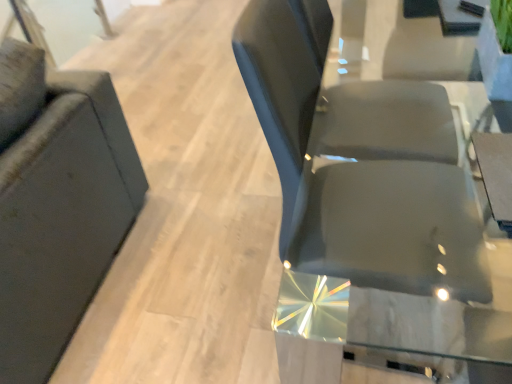
Question: Does transparent glass door at upper left have a larger size compared to glossy black chair at center, acting as the 2th chair starting from the left?

Choices:
 (A) no
 (B) yes

Answer: (A)

Question: Would you consider transparent glass door at upper left to be distant from glossy black chair at center, acting as the 2th chair starting from the left?

Choices:
 (A) yes
 (B) no

Answer: (A)

Question: Is transparent glass door at upper left wider than glossy black chair at center, acting as the 2th chair starting from the left?

Choices:
 (A) yes
 (B) no

Answer: (B)

Question: Considering the relative sizes of transparent glass door at upper left and glossy black chair at center, acting as the 2th chair starting from the left, in the image provided, is transparent glass door at upper left thinner than glossy black chair at center, acting as the 2th chair starting from the left,?

Choices:
 (A) yes
 (B) no

Answer: (A)

Question: Considering the relative positions of transparent glass door at upper left and glossy black chair at center, marked as the first chair in a right-to-left arrangement, in the image provided, is transparent glass door at upper left behind glossy black chair at center, marked as the first chair in a right-to-left arrangement,?

Choices:
 (A) no
 (B) yes

Answer: (B)

Question: Do you think glossy black chair at center, marked as the first chair in a right-to-left arrangement, is within matte black chair at left, which is counted as the first chair, starting from the left, or outside of it?

Choices:
 (A) outside
 (B) inside

Answer: (A)

Question: Is glossy black chair at center, acting as the 2th chair starting from the left, bigger or smaller than matte black chair at left, which appears as the 2th chair when viewed from the right?

Choices:
 (A) big
 (B) small

Answer: (B)

Question: Is glossy black chair at center, acting as the 2th chair starting from the left, wider or thinner than matte black chair at left, which is counted as the first chair, starting from the left?

Choices:
 (A) wide
 (B) thin

Answer: (B)

Question: From their relative heights in the image, would you say glossy black chair at center, acting as the 2th chair starting from the left, is taller or shorter than matte black chair at left, which is counted as the first chair, starting from the left?

Choices:
 (A) tall
 (B) short

Answer: (A)

Question: Is glossy black chair at center, acting as the 2th chair starting from the left, taller or shorter than transparent glass door at upper left?

Choices:
 (A) tall
 (B) short

Answer: (A)

Question: From a real-world perspective, relative to transparent glass door at upper left, is glossy black chair at center, marked as the first chair in a right-to-left arrangement, vertically above or below?

Choices:
 (A) above
 (B) below

Answer: (A)

Question: Would you say glossy black chair at center, marked as the first chair in a right-to-left arrangement, is inside or outside transparent glass door at upper left?

Choices:
 (A) inside
 (B) outside

Answer: (B)

Question: Considering the relative positions of glossy black chair at center, acting as the 2th chair starting from the left, and transparent glass door at upper left in the image provided, is glossy black chair at center, acting as the 2th chair starting from the left, to the left or to the right of transparent glass door at upper left?

Choices:
 (A) left
 (B) right

Answer: (B)

Question: Based on their positions, is matte black chair at left, which appears as the 2th chair when viewed from the right, located to the left or right of transparent glass door at upper left?

Choices:
 (A) left
 (B) right

Answer: (B)

Question: From a real-world perspective, is matte black chair at left, which is counted as the first chair, starting from the left, above or below transparent glass door at upper left?

Choices:
 (A) above
 (B) below

Answer: (A)